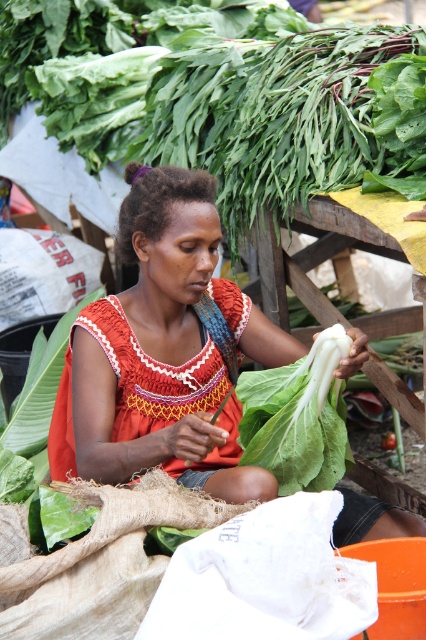
Question: Estimate the real-world distances between objects in this image. Which object is closer to the green leafy vegetable at upper center?

Choices:
 (A) white leafy green at center
 (B) matte orange blouse at center

Answer: (B)

Question: Which of these objects is positioned farthest from the white leafy green at center?

Choices:
 (A) green leafy vegetable at upper center
 (B) matte orange blouse at center

Answer: (A)

Question: Does matte orange blouse at center appear under white leafy green at center?

Choices:
 (A) no
 (B) yes

Answer: (A)

Question: Is matte orange blouse at center positioned before white leafy green at center?

Choices:
 (A) yes
 (B) no

Answer: (A)

Question: Can you confirm if matte orange blouse at center is smaller than white leafy green at center?

Choices:
 (A) no
 (B) yes

Answer: (A)

Question: Which point is closer to the camera taking this photo?

Choices:
 (A) (288, 380)
 (B) (262, 499)
 (C) (368, 156)

Answer: (B)